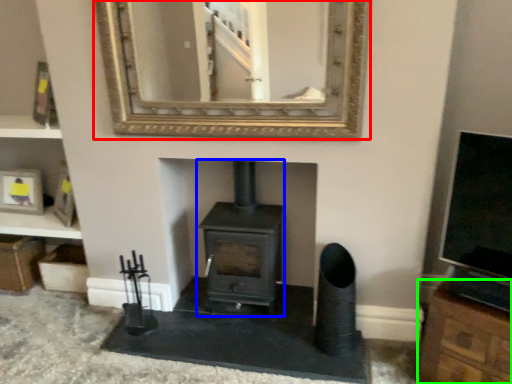
Question: Which object is the farthest from mirror (highlighted by a red box)? Choose among these: wood burning stove (highlighted by a blue box) or cabinetry (highlighted by a green box).

Choices:
 (A) wood burning stove
 (B) cabinetry

Answer: (B)